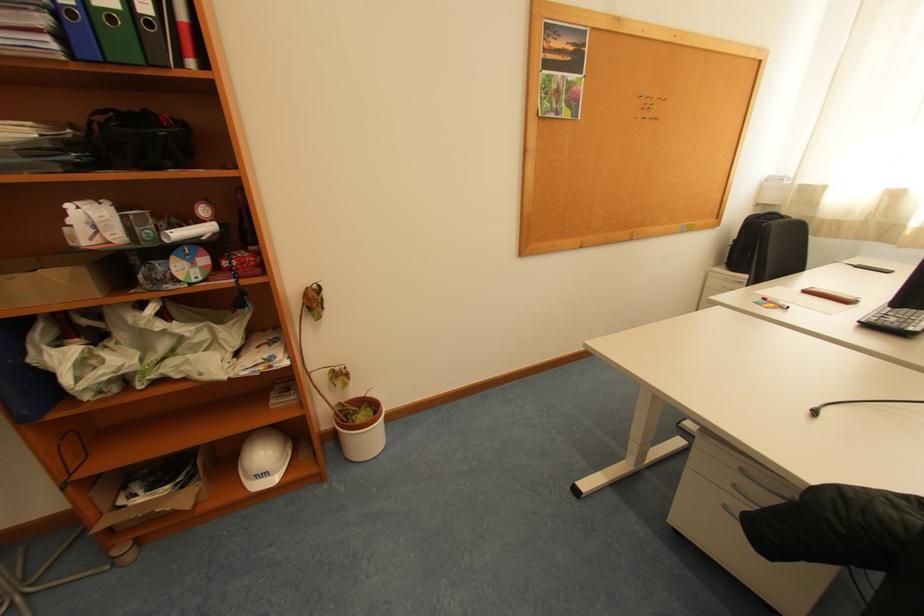
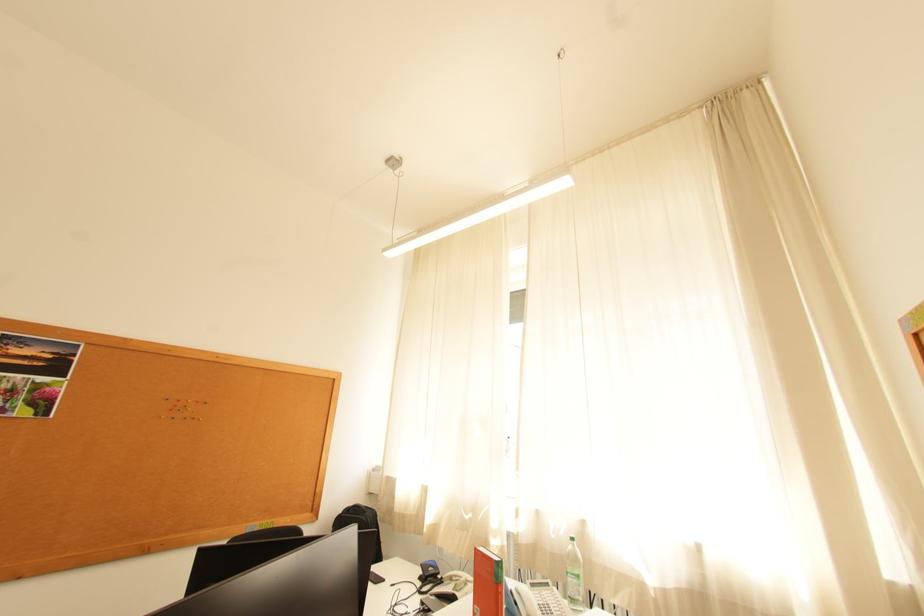
Locate, in the second image, the point that corresponds to (x=654, y=108) in the first image.

(186, 408)